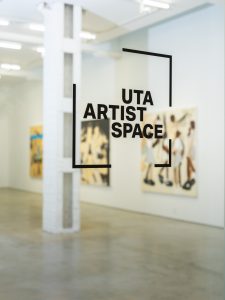
Find the location of a particular element. Image resolution: width=225 pixels, height=300 pixels. bright white ceiling is located at coordinates pyautogui.click(x=25, y=56).